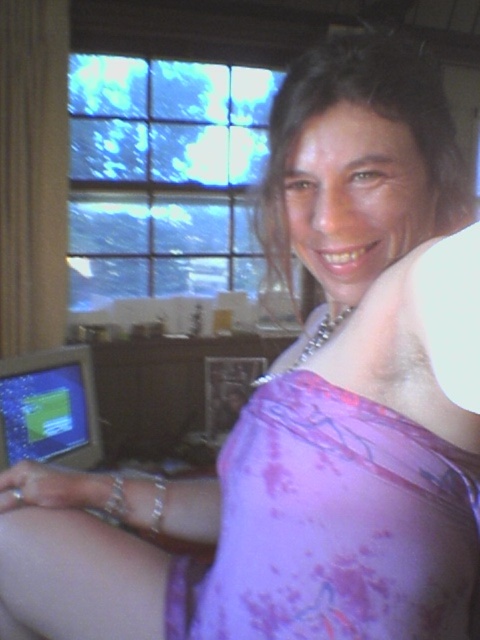
You are organizing a photoshoot and need to position a model wearing the purple satin dress at center so that it is visible in the frame without being obscured by the matte plastic monitor at lower left. Based on the scene description, where should you place the model relative to the monitor?

The purple satin dress at center is located above the matte plastic monitor at lower left, so placing the model above the monitor will ensure the dress remains visible and not blocked by the monitor.

You are organizing a photoshoot and need to place the purple satin dress at center and the matte plastic monitor at lower left in a way that aligns with their current positions. Which object should be placed to the right of the other?

The purple satin dress at center should be placed to the right of the matte plastic monitor at lower left because the purple satin dress at center is positioned on the right side of matte plastic monitor at lower left.